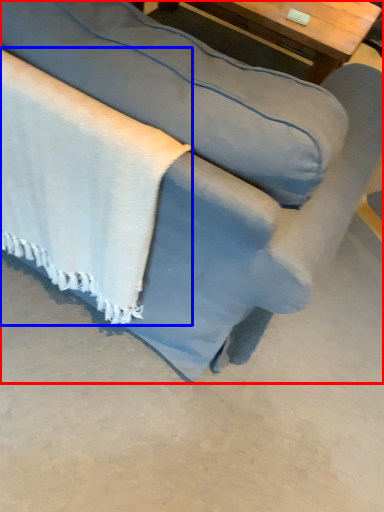
Question: Which of the following is the closest to the observer, studio couch (highlighted by a red box) or blanket (highlighted by a blue box)?

Choices:
 (A) studio couch
 (B) blanket

Answer: (A)